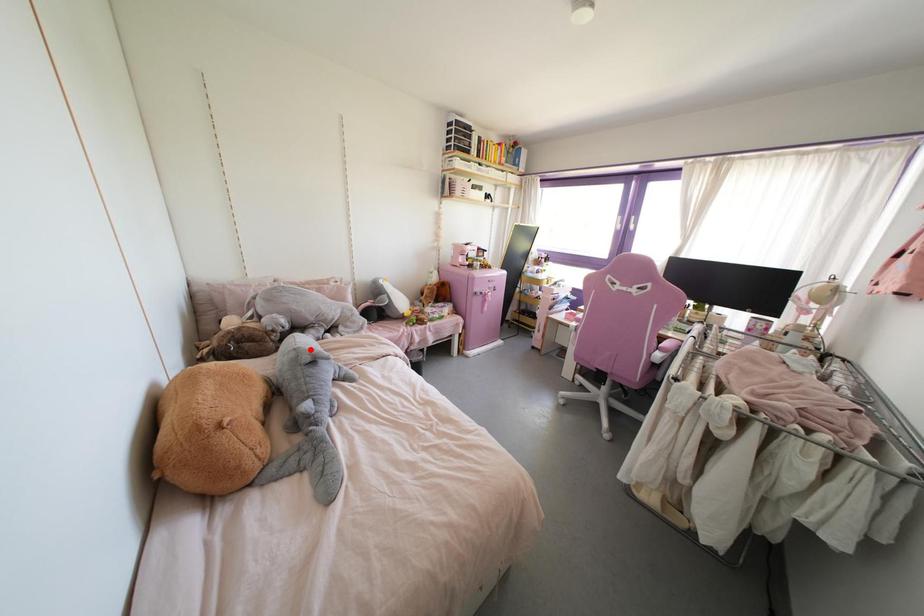
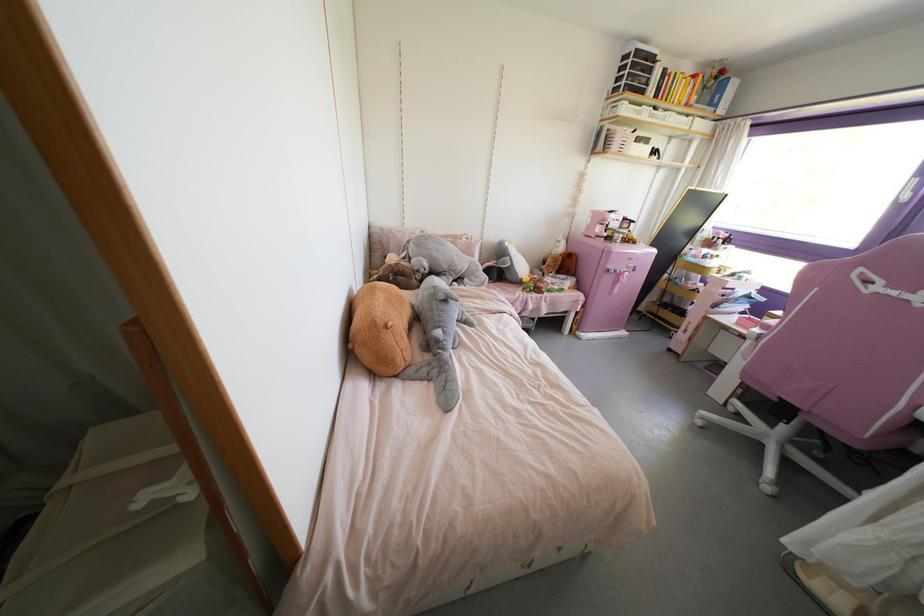
The point at the highlighted location is marked in the first image. Where is the corresponding point in the second image?

(444, 290)